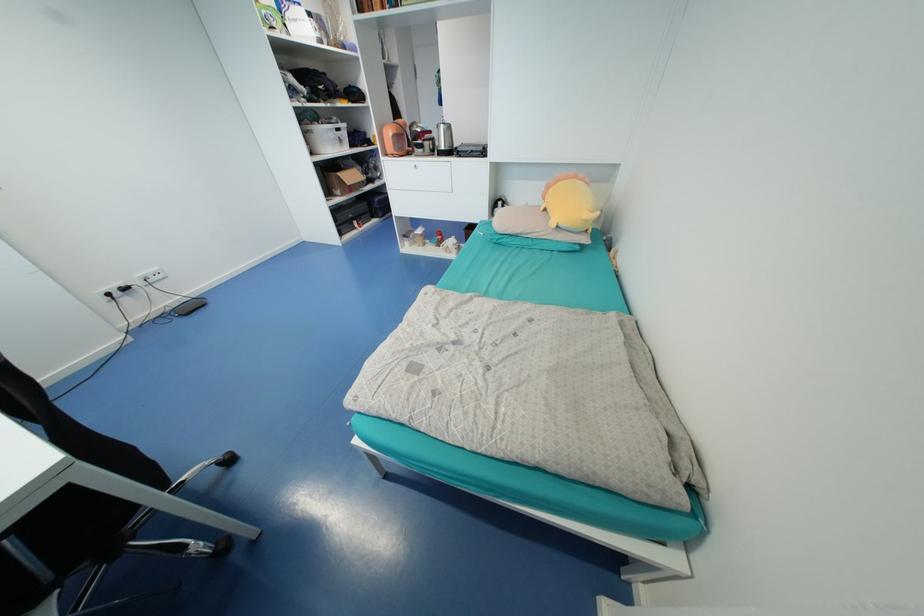
Identify the location of orange appliance handle. coord(394,139).